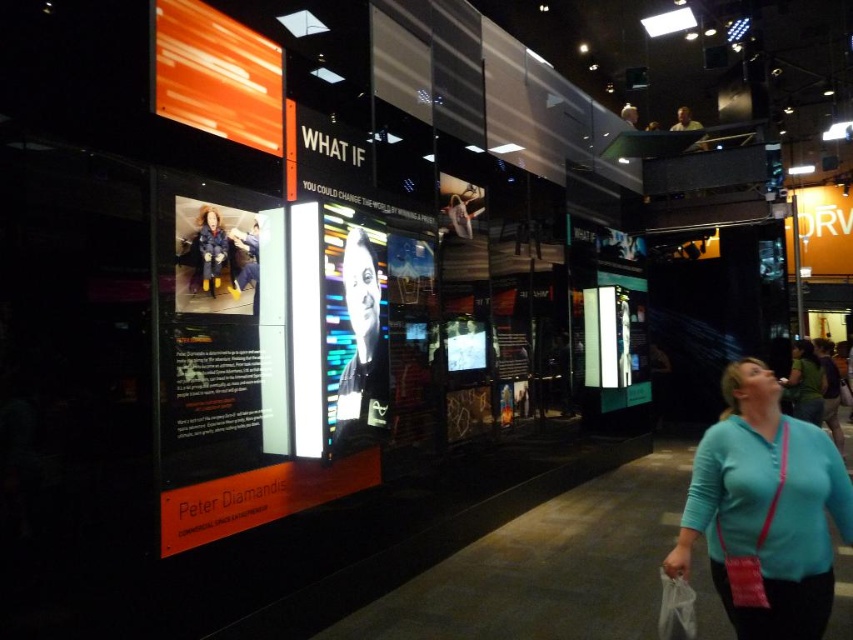
You are at the exhibit and want to take a photo of both the orange glossy screen at upper left and the black glossy portrait at center. Which object should you focus on first to ensure both are in the frame?

The orange glossy screen at upper left is located above the black glossy portrait at center, so you should focus on the black glossy portrait at center first to ensure both are in the frame.